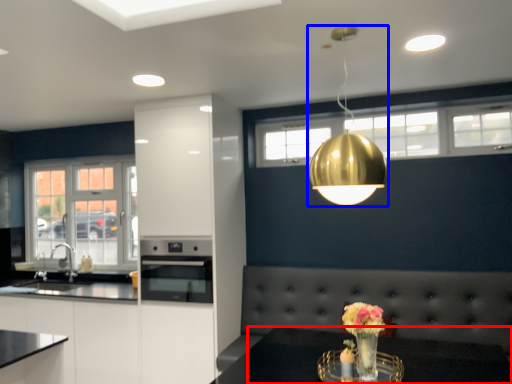
Question: Which of the following is the closest to the observer, table (highlighted by a red box) or lamp (highlighted by a blue box)?

Choices:
 (A) table
 (B) lamp

Answer: (A)